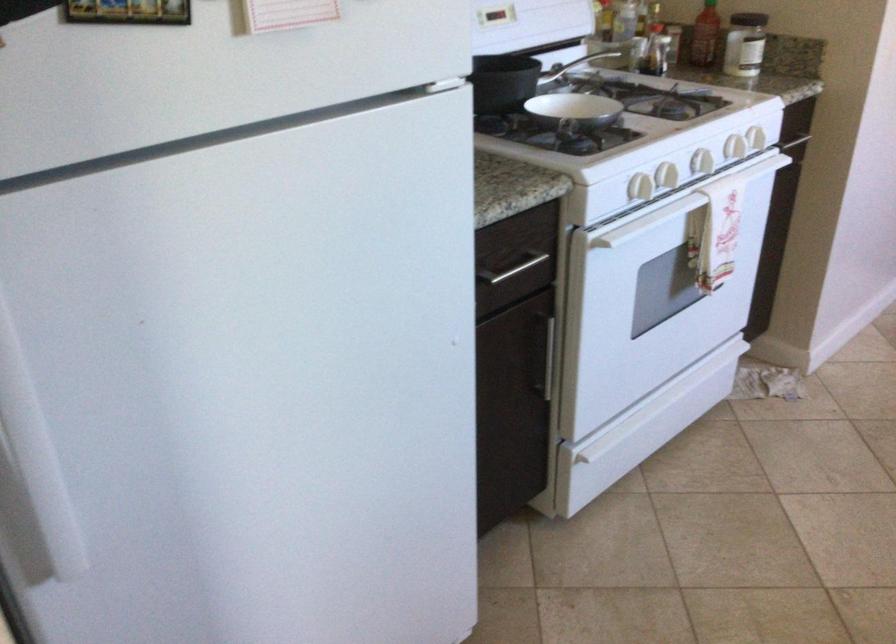
At what (x,y) coordinates should I click in order to perform the action: click on white refrigerator handle. Please return your answer as a coordinate pair (x, y). This screenshot has height=644, width=896. Looking at the image, I should click on [33, 460].